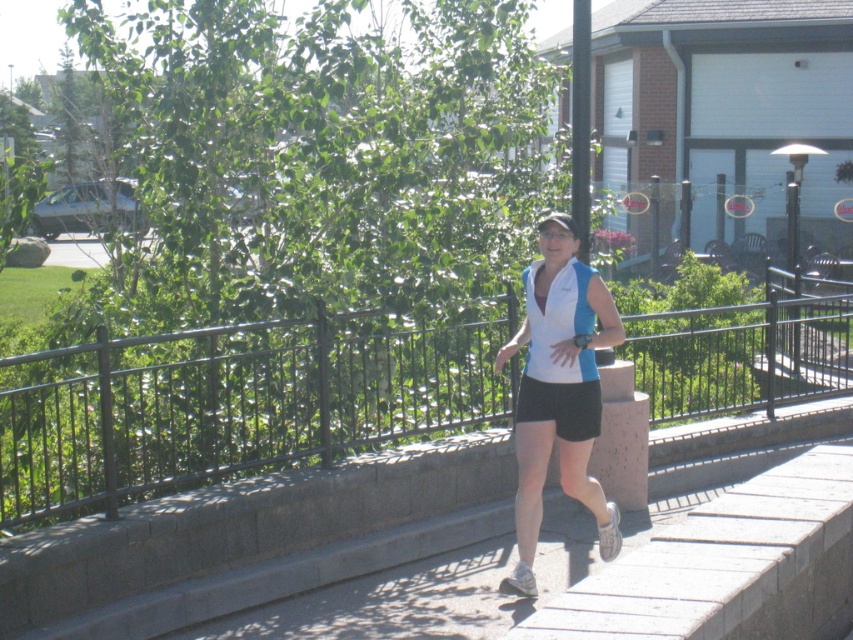
Question: Which point is farther to the camera?

Choices:
 (A) white fabric shirt at center
 (B) white/blue fabric vest at center

Answer: (B)

Question: Is black metal rail at center smaller than white fabric shirt at center?

Choices:
 (A) no
 (B) yes

Answer: (A)

Question: Which point appears farthest from the camera in this image?

Choices:
 (A) (531, 301)
 (B) (33, 481)
 (C) (521, 387)

Answer: (C)

Question: Does black metal rail at center have a larger size compared to white/blue fabric vest at center?

Choices:
 (A) yes
 (B) no

Answer: (A)

Question: Which point appears closest to the camera in this image?

Choices:
 (A) (581, 294)
 (B) (828, 337)

Answer: (A)

Question: Is black metal rail at center bigger than white fabric shirt at center?

Choices:
 (A) yes
 (B) no

Answer: (A)